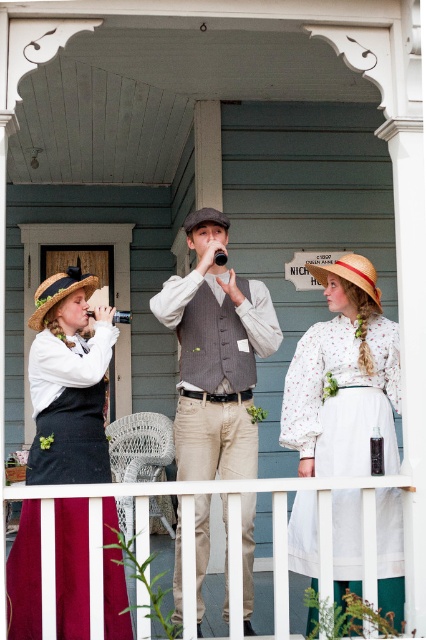
Question: Which of the following is the closest to the observer?

Choices:
 (A) (356, 518)
 (B) (195, 211)

Answer: (A)

Question: Which of these objects is positioned closest to the natural straw hat at center?

Choices:
 (A) white floral blouse at center
 (B) matte black hat at left
 (C) brown felt cowboy hat at center
 (D) natural straw hat at left

Answer: (A)

Question: Based on their relative distances, which object is farther from the natural straw hat at center?

Choices:
 (A) white floral blouse at center
 (B) wooden railing at center

Answer: (B)

Question: Is gray wool vest at center bigger than brown felt cowboy hat at center?

Choices:
 (A) yes
 (B) no

Answer: (A)

Question: Can you confirm if white floral blouse at center is wider than wooden railing at center?

Choices:
 (A) yes
 (B) no

Answer: (B)

Question: Is white floral blouse at center wider than gray wool vest at center?

Choices:
 (A) no
 (B) yes

Answer: (A)